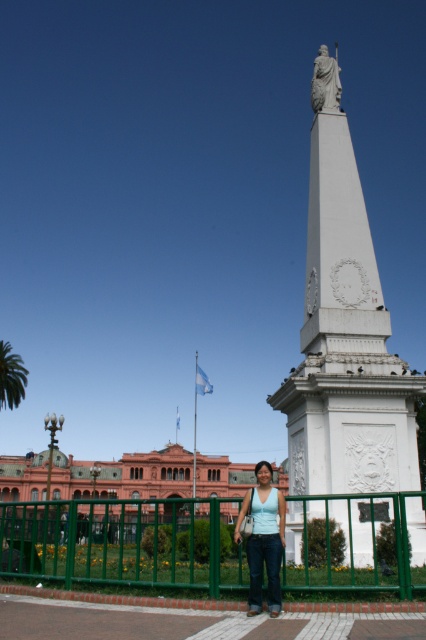
Does light blue denim jeans at center appear on the left side of white marble statue at upper center?

Correct, you'll find light blue denim jeans at center to the left of white marble statue at upper center.

Describe the element at coordinates (264, 538) in the screenshot. I see `light blue denim jeans at center` at that location.

What are the coordinates of `light blue denim jeans at center` in the screenshot? It's located at (264, 538).

Is white marble obelisk at center shorter than matte pink building at center?

In fact, white marble obelisk at center may be taller than matte pink building at center.

Is white marble obelisk at center positioned in front of matte pink building at center?

Yes, white marble obelisk at center is closer to the viewer.

Is point (377, 401) closer to viewer compared to point (13, 474)?

Yes.

Locate an element on the screen. The width and height of the screenshot is (426, 640). white marble obelisk at center is located at coordinates (345, 344).

Is green metal fence at lower center to the right of light blue denim jeans at center from the viewer's perspective?

Incorrect, green metal fence at lower center is not on the right side of light blue denim jeans at center.

Is green metal fence at lower center in front of light blue denim jeans at center?

Yes, green metal fence at lower center is closer to the viewer.

Who is more distant from viewer, (57, 520) or (258, 552)?

The point (57, 520) is behind.

Where is `green metal fence at lower center`? green metal fence at lower center is located at coordinates (123, 544).